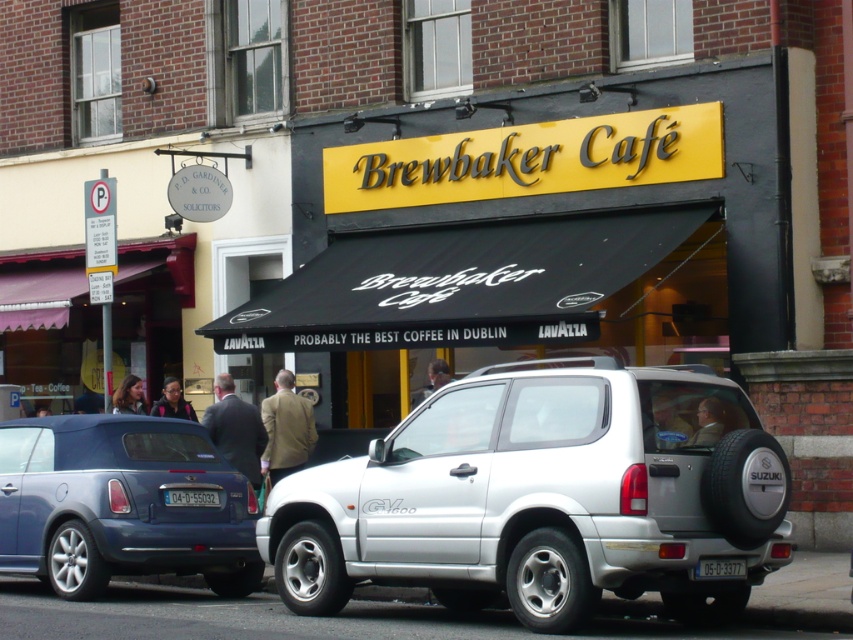
Question: Which object is the farthest from the tan leather jacket at center?

Choices:
 (A) dark suit at center
 (B) white plastic license plate at center
 (C) gray metallic license plate at center
 (D) metallic blue convertible at lower left

Answer: (C)

Question: Among these points, which one is farthest from the camera?

Choices:
 (A) (207, 410)
 (B) (374, 552)

Answer: (A)

Question: Is dark brown leather jacket at center below white plastic license plate at center?

Choices:
 (A) yes
 (B) no

Answer: (B)

Question: Which point appears farthest from the camera in this image?

Choices:
 (A) coord(279,440)
 (B) coord(19,470)
 (C) coord(701,563)

Answer: (A)

Question: Does dark suit at center have a lesser width compared to white plastic license plate at center?

Choices:
 (A) no
 (B) yes

Answer: (A)

Question: Does dark suit at center appear over dark brown leather jacket at center?

Choices:
 (A) yes
 (B) no

Answer: (A)